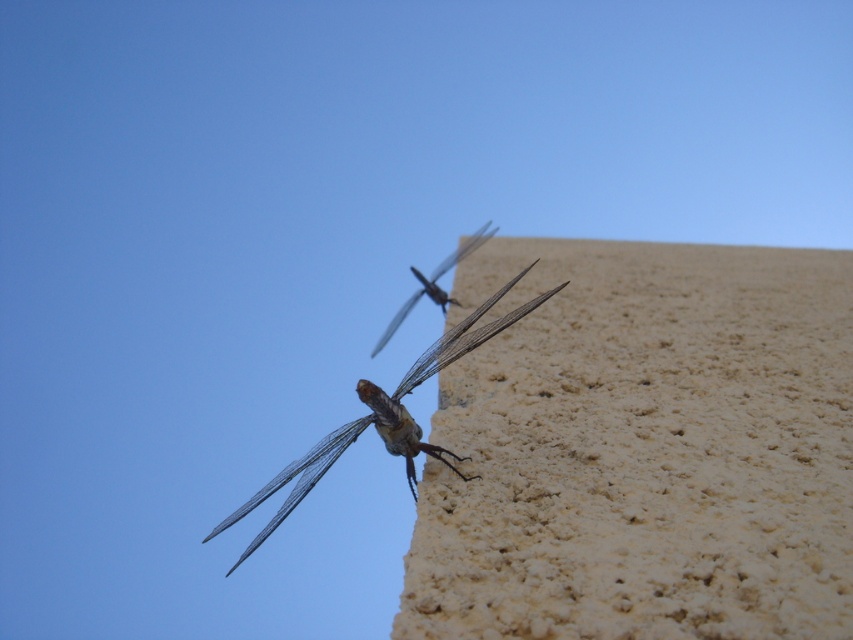
Is translucent glass dragonfly at upper center further to the viewer compared to translucent winged insect at upper center?

No, it is in front of translucent winged insect at upper center.

Describe the element at coordinates (296, 483) in the screenshot. The width and height of the screenshot is (853, 640). I see `translucent glass dragonfly at upper center` at that location.

At what (x,y) coordinates should I click in order to perform the action: click on translucent glass dragonfly at upper center. Please return your answer as a coordinate pair (x, y). Looking at the image, I should click on (296, 483).